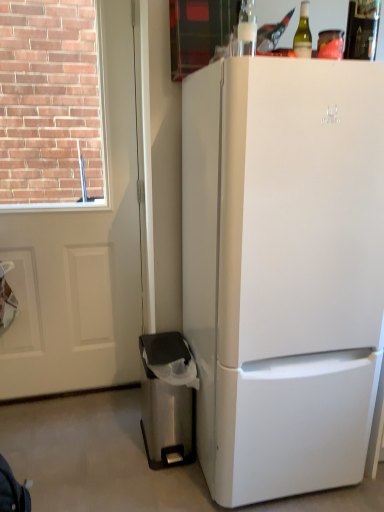
This screenshot has width=384, height=512. Identify the location of vacant space situated on the left part of stainless steel trash can at lower left. (111, 448).